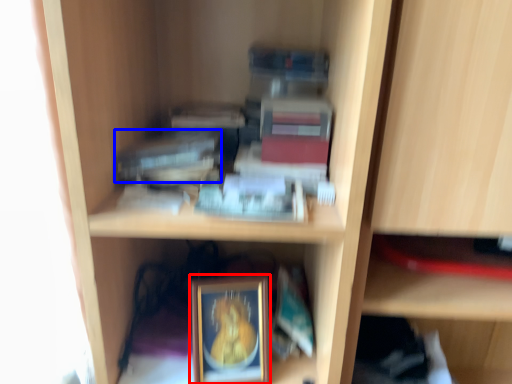
Question: Which point is closer to the camera, picture frame (highlighted by a red box) or paperback book (highlighted by a blue box)?

Choices:
 (A) picture frame
 (B) paperback book

Answer: (B)